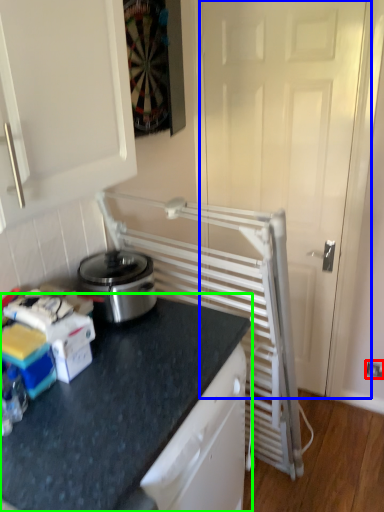
Question: Estimate the real-world distances between objects in this image. Which object is closer to electric outlet (highlighted by a red box), screen door (highlighted by a blue box) or countertop (highlighted by a green box)?

Choices:
 (A) screen door
 (B) countertop

Answer: (A)